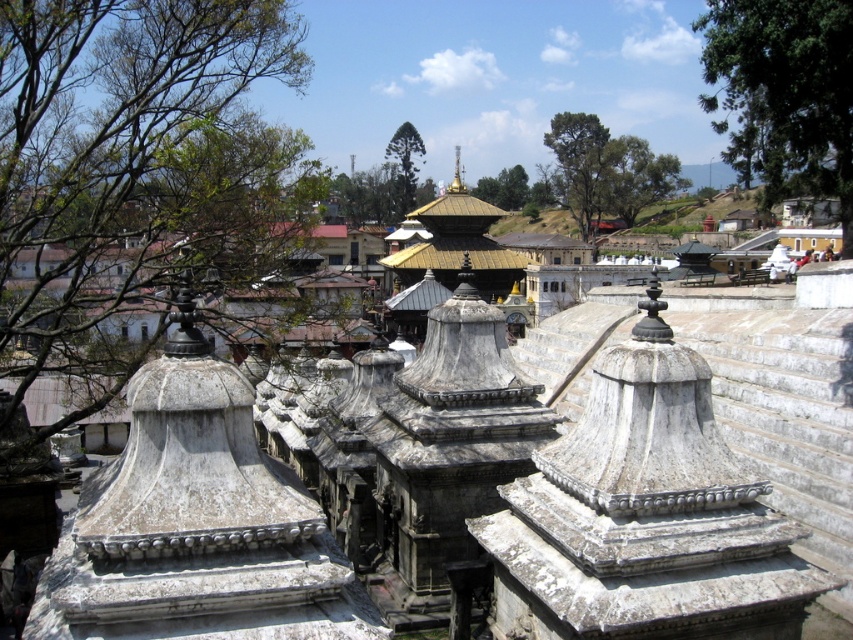
From the picture: Which is more to the left, green leafy tree at upper left or green leafy tree at upper right?

green leafy tree at upper left is more to the left.

Between green leafy tree at upper left and green leafy tree at upper right, which one has less height?

green leafy tree at upper right

Where is `green leafy tree at upper left`? The height and width of the screenshot is (640, 853). green leafy tree at upper left is located at coordinates pyautogui.click(x=132, y=180).

Who is higher up, green leafy tree at upper right or green textured tree at center?

green textured tree at center is higher up.

Who is more forward, (782,120) or (397,148)?

Point (782,120) is more forward.

What are the coordinates of `green leafy tree at upper right` in the screenshot? It's located at (785, 93).

Which is in front, point (306, 184) or point (412, 168)?

Positioned in front is point (306, 184).

Which is more to the right, green leafy tree at upper left or green textured tree at center?

green textured tree at center is more to the right.

Find the location of a particular element. The width and height of the screenshot is (853, 640). green leafy tree at upper left is located at coordinates (132, 180).